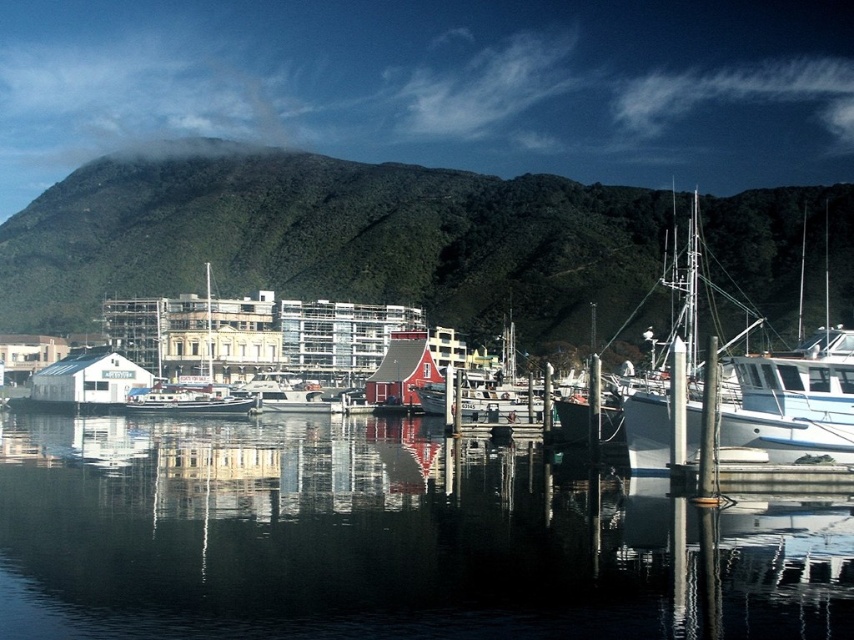
Question: Which of these objects is positioned closest to the white matte boat at right?

Choices:
 (A) green forested mountain at upper center
 (B) white glossy boat at center

Answer: (B)

Question: Can you confirm if white matte boat at right is positioned above white glossy boat at center?

Choices:
 (A) yes
 (B) no

Answer: (A)

Question: Can you confirm if green forested mountain at upper center is positioned above white glossy boat at center?

Choices:
 (A) no
 (B) yes

Answer: (B)

Question: In this image, where is white matte boat at right located relative to white glossy boat at center?

Choices:
 (A) left
 (B) right

Answer: (B)

Question: Which point is farther to the camera?

Choices:
 (A) white glossy boat at center
 (B) white matte boat at right
 (C) green forested mountain at upper center

Answer: (C)

Question: Which object appears farthest from the camera in this image?

Choices:
 (A) white glossy boat at center
 (B) white matte boat at right

Answer: (A)